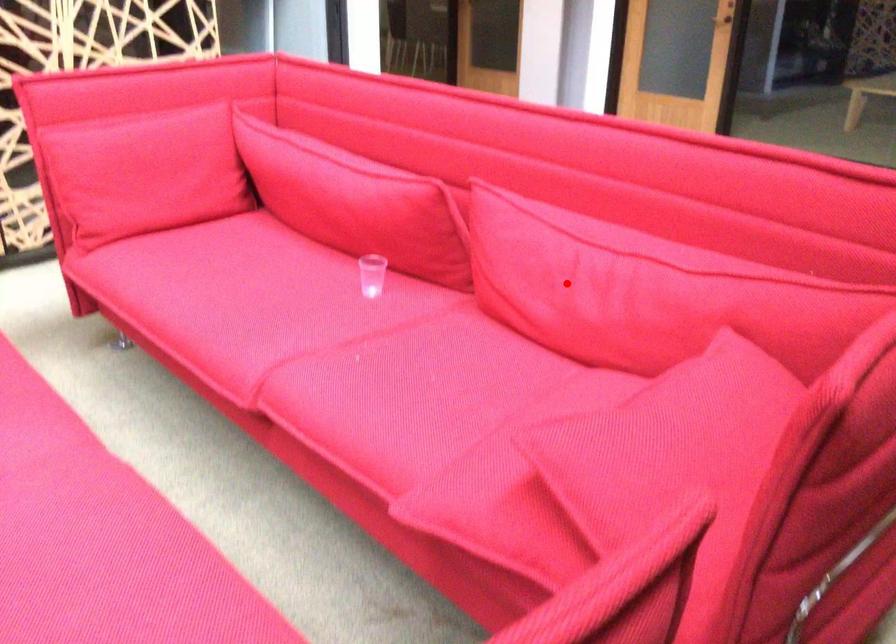
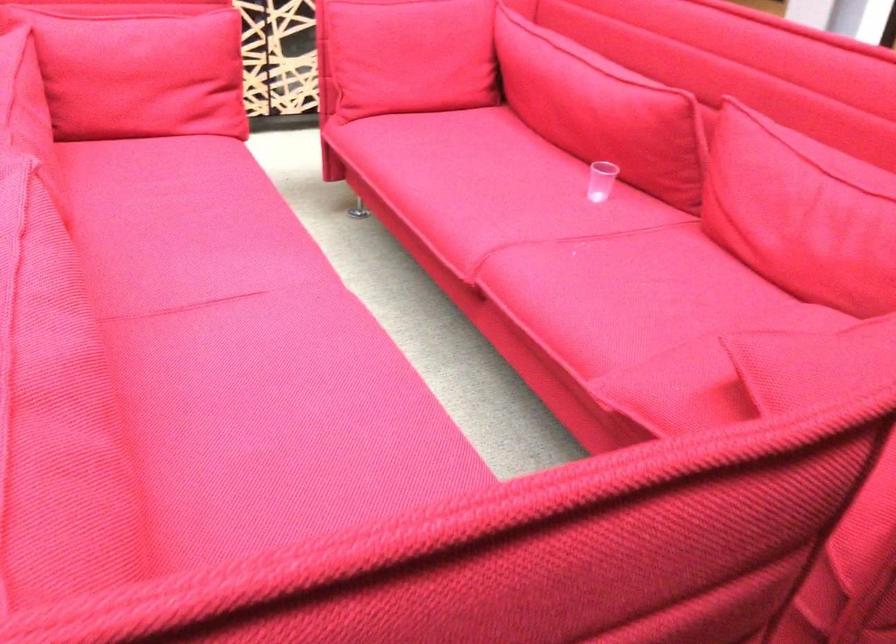
Find the pixel in the second image that matches the highlighted location in the first image.

(800, 213)